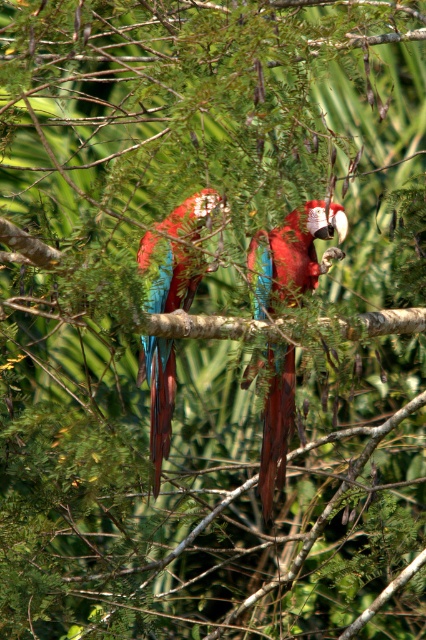
Question: Which point is farther from the camera taking this photo?

Choices:
 (A) (278, 234)
 (B) (155, 362)

Answer: (B)

Question: In this image, where is shiny metallic parrot at center located relative to glossy metallic parrot at center?

Choices:
 (A) right
 (B) left

Answer: (A)

Question: Can you confirm if shiny metallic parrot at center is positioned above glossy metallic parrot at center?

Choices:
 (A) no
 (B) yes

Answer: (A)

Question: Among these objects, which one is farthest from the camera?

Choices:
 (A) glossy metallic parrot at center
 (B) shiny metallic parrot at center

Answer: (B)

Question: Is the position of shiny metallic parrot at center less distant than that of glossy metallic parrot at center?

Choices:
 (A) yes
 (B) no

Answer: (B)

Question: Which object is farther from the camera taking this photo?

Choices:
 (A) glossy metallic parrot at center
 (B) shiny metallic parrot at center

Answer: (B)